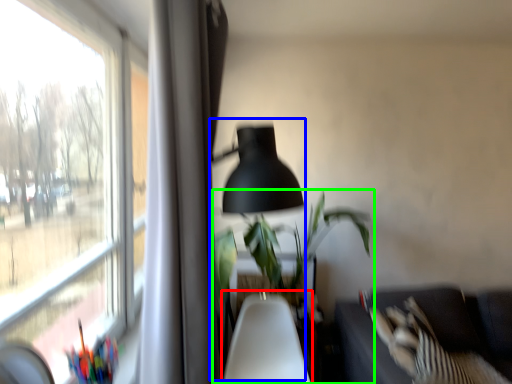
Question: Which is nearer to the swivel chair (highlighted by a red box)? table lamp (highlighted by a blue box) or houseplant (highlighted by a green box).

Choices:
 (A) table lamp
 (B) houseplant

Answer: (B)